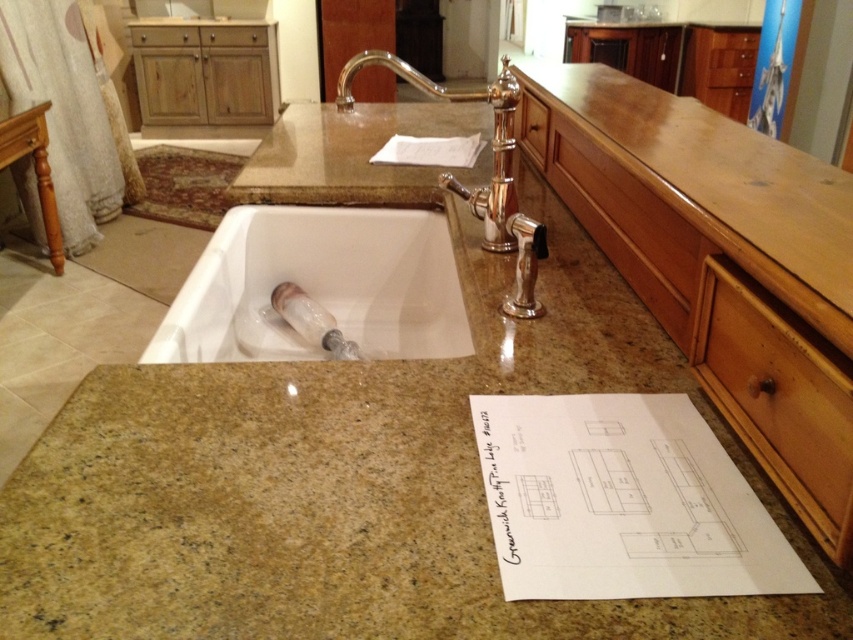
You are a contractor holding a 12 inch ruler. You want to measure the distance between your current position and the white paper at center. Can you reach it without moving your hand?

The distance of white paper at center from camera is 23.73 inches. Since your ruler is only 12 inches long, you cannot reach the white paper at center with it without moving your hand.

You are an architect reviewing the blueprint on the white paper at upper center and the wooden drawer at upper left. Which object is taller?

The wooden drawer at upper left is taller than the white paper at upper center.